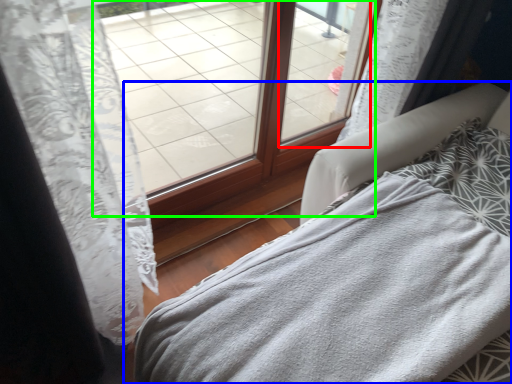
Question: Which is farther away from window (highlighted by a red box)? furniture (highlighted by a blue box) or window (highlighted by a green box)?

Choices:
 (A) furniture
 (B) window

Answer: (A)